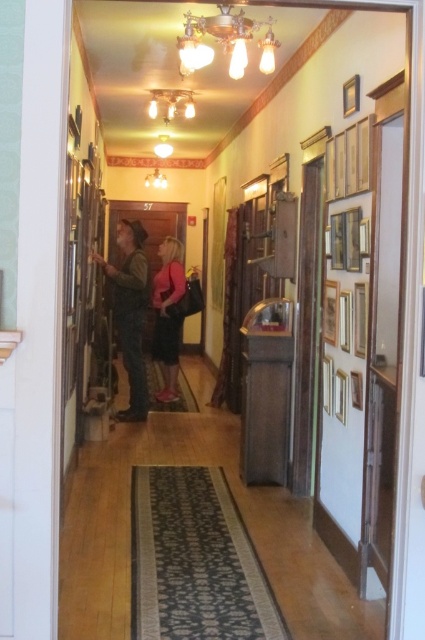
You are a dancer preparing for a performance and need to walk down the hallway. You are wearing the matte pink dress at center and carrying the camouflage pants at center over your shoulder. The hallway is narrow. Do you think you can walk through the hallway without touching the walls?

The camouflage pants at center is wider than the matte pink dress at center. Since the hallway is narrow and the camouflage pants at center are wider, there might not be enough space to walk through without touching the walls.

You are a fashion designer who is 1.7 meters tall. You are standing in the hallway and see the camouflage pants at center and the matte pink dress at center. You want to hang both items on a single coat rack located at the end of the hallway. Considering their sizes, which item should you place higher on the coat rack to ensure both items are visible?

Since the camouflage pants at center is bigger than the matte pink dress at center, you should place the camouflage pants at center higher on the coat rack to ensure both items are visible without the smaller matte pink dress at center being obscured.